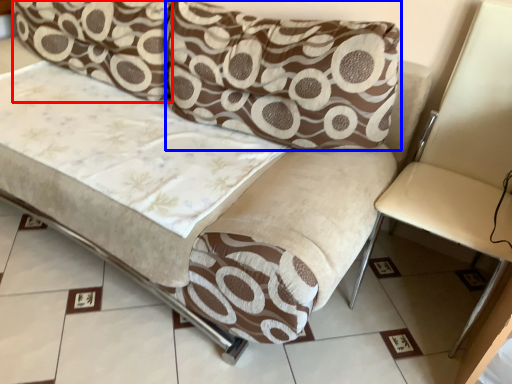
Question: Which point is closer to the camera, pillow (highlighted by a red box) or pillow (highlighted by a blue box)?

Choices:
 (A) pillow
 (B) pillow

Answer: (B)